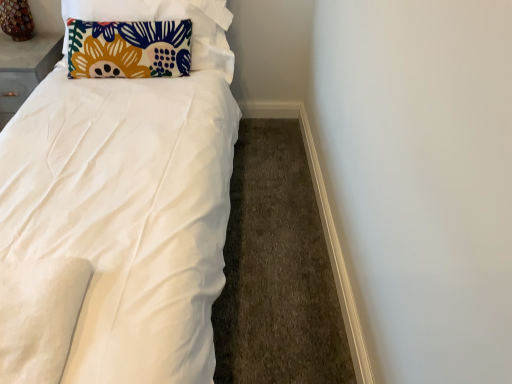
Locate an element on the screen. Image resolution: width=512 pixels, height=384 pixels. white smooth baseboard at lower right is located at coordinates (332, 246).

This screenshot has width=512, height=384. Describe the element at coordinates (16, 19) in the screenshot. I see `wooden table lamp at upper left` at that location.

Where is `wooden table lamp at upper left`? The width and height of the screenshot is (512, 384). wooden table lamp at upper left is located at coordinates (16, 19).

This screenshot has width=512, height=384. I want to click on white smooth baseboard at lower right, so click(332, 246).

Does matte gray table at upper left touch white smooth baseboard at lower right?

They are not placed beside each other.

Does matte gray table at upper left have a smaller size compared to white smooth baseboard at lower right?

No, matte gray table at upper left is not smaller than white smooth baseboard at lower right.

Is white smooth baseboard at lower right at the back of matte gray table at upper left?

No, matte gray table at upper left is not facing away from white smooth baseboard at lower right.

From the picture: Is wooden table lamp at upper left placed right next to white smooth baseboard at lower right?

They are not placed beside each other.

Is wooden table lamp at upper left oriented towards white smooth baseboard at lower right?

No.

From the image's perspective, is wooden table lamp at upper left on white smooth baseboard at lower right?

Indeed, from the image's perspective, wooden table lamp at upper left is shown above white smooth baseboard at lower right.

Is wooden table lamp at upper left bigger or smaller than white smooth baseboard at lower right?

Clearly, wooden table lamp at upper left is larger in size than white smooth baseboard at lower right.

How different are the orientations of white smooth baseboard at lower right and matte gray table at upper left in degrees?

white smooth baseboard at lower right and matte gray table at upper left are facing 87.1 degrees away from each other.

Choose the correct answer: Is white smooth baseboard at lower right inside matte gray table at upper left or outside it?

The correct answer is: outside.

Considering the relative positions of white smooth baseboard at lower right and matte gray table at upper left in the image provided, is white smooth baseboard at lower right to the right of matte gray table at upper left from the viewer's perspective?

Yes, white smooth baseboard at lower right is to the right of matte gray table at upper left.

Are wooden table lamp at upper left and floral fabric pillow at upper left far apart?

Actually, wooden table lamp at upper left and floral fabric pillow at upper left are a little close together.

Does wooden table lamp at upper left lie in front of floral fabric pillow at upper left?

That is False.

Is wooden table lamp at upper left bigger or smaller than floral fabric pillow at upper left?

Clearly, wooden table lamp at upper left is smaller in size than floral fabric pillow at upper left.

Is point (13, 32) closer or farther from the camera than point (65, 16)?

Clearly, point (13, 32) is more distant from the camera than point (65, 16).

How different are the orientations of floral fabric pillow at upper left and matte gray table at upper left in degrees?

7.11 degrees.

Looking at this image, based on their sizes in the image, would you say floral fabric pillow at upper left is bigger or smaller than matte gray table at upper left?

In the image, floral fabric pillow at upper left appears to be larger than matte gray table at upper left.

Is floral fabric pillow at upper left positioned with its back to matte gray table at upper left?

No.

From the image's perspective, between floral fabric pillow at upper left and matte gray table at upper left, who is located below?

matte gray table at upper left.

How much distance is there between wooden table lamp at upper left and matte gray table at upper left?

A distance of 7.78 inches exists between wooden table lamp at upper left and matte gray table at upper left.

Looking at this image, who is bigger, wooden table lamp at upper left or matte gray table at upper left?

With larger size is matte gray table at upper left.

Considering the sizes of objects wooden table lamp at upper left and matte gray table at upper left in the image provided, who is thinner, wooden table lamp at upper left or matte gray table at upper left?

Thinner between the two is wooden table lamp at upper left.

Considering the sizes of wooden table lamp at upper left and matte gray table at upper left in the image, is wooden table lamp at upper left taller or shorter than matte gray table at upper left?

Considering their sizes, wooden table lamp at upper left has less height than matte gray table at upper left.

Is floral fabric pillow at upper left beside wooden table lamp at upper left?

No, floral fabric pillow at upper left is not making contact with wooden table lamp at upper left.

In the scene shown: From a real-world perspective, between floral fabric pillow at upper left and wooden table lamp at upper left, who is vertically lower?

floral fabric pillow at upper left is physically lower.

Which is farther from the camera, (217, 55) or (8, 22)?

The point (8, 22) is farther.

Is wooden table lamp at upper left inside floral fabric pillow at upper left?

Definitely not — wooden table lamp at upper left is not inside floral fabric pillow at upper left.

The height and width of the screenshot is (384, 512). Identify the location of trim located underneath the matte gray table at upper left (from a real-world perspective). (332, 246).

Find the location of a particular element. This screenshot has height=384, width=512. trim located below the wooden table lamp at upper left (from the image's perspective) is located at coordinates [332, 246].

Based on their spatial positions, is white smooth baseboard at lower right or matte gray table at upper left closer to floral fabric pillow at upper left?

Among the two, matte gray table at upper left is located nearer to floral fabric pillow at upper left.

Looking at the image, which one is located further to white smooth baseboard at lower right, matte gray table at upper left or floral fabric pillow at upper left?

matte gray table at upper left is positioned further to the anchor white smooth baseboard at lower right.

Which object lies nearer to the anchor point white smooth baseboard at lower right, wooden table lamp at upper left or matte gray table at upper left?

matte gray table at upper left.

Based on their spatial positions, is matte gray table at upper left or wooden table lamp at upper left closer to white smooth baseboard at lower right?

Based on the image, matte gray table at upper left appears to be nearer to white smooth baseboard at lower right.

When comparing their distances from matte gray table at upper left, does white smooth baseboard at lower right or wooden table lamp at upper left seem further?

A: Among the two, white smooth baseboard at lower right is located further to matte gray table at upper left.

Estimate the real-world distances between objects in this image. Which object is closer to floral fabric pillow at upper left, matte gray table at upper left or white smooth baseboard at lower right?

matte gray table at upper left lies closer to floral fabric pillow at upper left than the other object.

Estimate the real-world distances between objects in this image. Which object is closer to floral fabric pillow at upper left, wooden table lamp at upper left or matte gray table at upper left?

Among the two, matte gray table at upper left is located nearer to floral fabric pillow at upper left.

Estimate the real-world distances between objects in this image. Which object is closer to floral fabric pillow at upper left, wooden table lamp at upper left or white smooth baseboard at lower right?

The object closer to floral fabric pillow at upper left is wooden table lamp at upper left.

Where is `pillow between matte gray table at upper left and white smooth baseboard at lower right`? This screenshot has height=384, width=512. pillow between matte gray table at upper left and white smooth baseboard at lower right is located at coordinates (170, 19).

Identify the location of pillow between wooden table lamp at upper left and white smooth baseboard at lower right from left to right. (170, 19).

You are a GUI agent. You are given a task and a screenshot of the screen. Output one action in this format:
    pyautogui.click(x=<x>, y=<y>)
    Task: Click on the table located between wooden table lamp at upper left and floral fabric pillow at upper left in the left-right direction
    The image size is (512, 384).
    Given the screenshot: What is the action you would take?
    pyautogui.click(x=24, y=69)

Find the location of a particular element. table between wooden table lamp at upper left and white smooth baseboard at lower right is located at coordinates (24, 69).